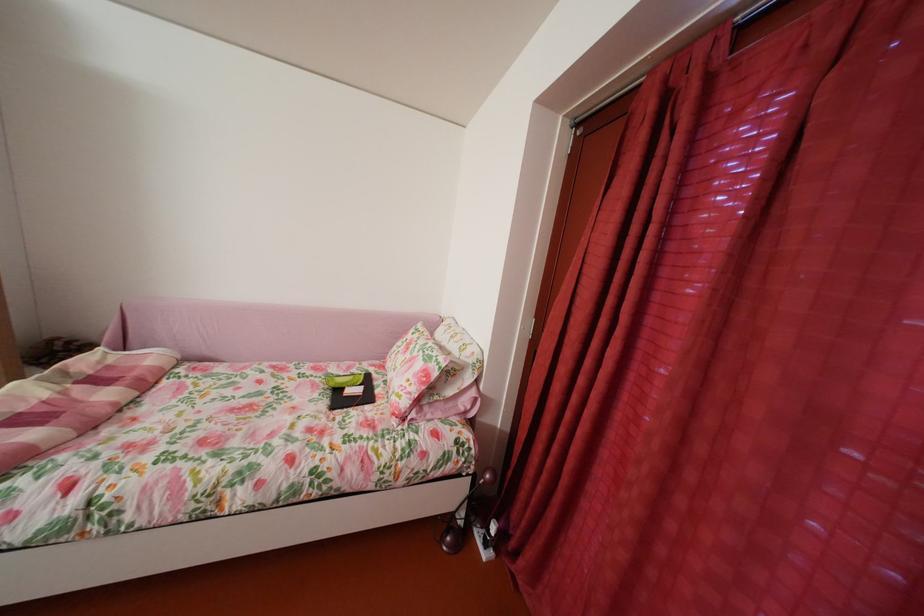
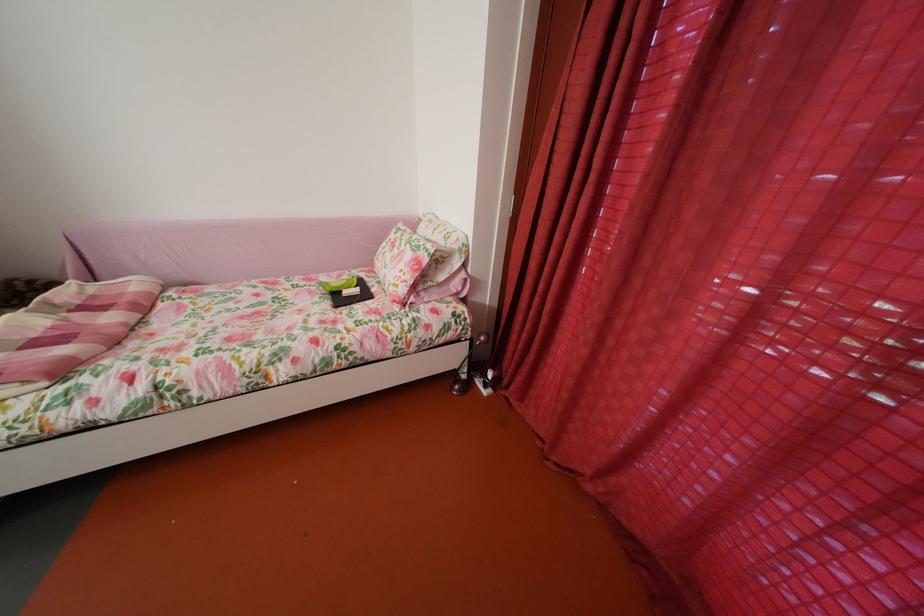
Locate, in the second image, the point that corresponds to [480,474] in the first image.

(478, 339)